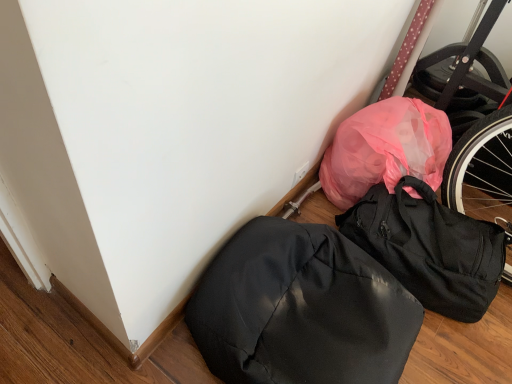
What do you see at coordinates (301, 309) in the screenshot?
I see `glossy black backpack at lower right, which is counted as the first backpack, starting from the left` at bounding box center [301, 309].

Where is `glossy black backpack at lower right, which is counted as the first backpack, starting from the left`? This screenshot has height=384, width=512. glossy black backpack at lower right, which is counted as the first backpack, starting from the left is located at coordinates (301, 309).

In order to click on matte black backpack at lower right, which is counted as the first backpack, starting from the right in this screenshot , I will do `click(430, 248)`.

What is the approximate width of matte black backpack at lower right, which is counted as the first backpack, starting from the right?

16.97 inches.

The width and height of the screenshot is (512, 384). Describe the element at coordinates (430, 248) in the screenshot. I see `matte black backpack at lower right, which is counted as the first backpack, starting from the right` at that location.

Where is `glossy black backpack at lower right, the 2th backpack viewed from the right`? glossy black backpack at lower right, the 2th backpack viewed from the right is located at coordinates (301, 309).

Would you say glossy black backpack at lower right, the 2th backpack viewed from the right, is to the left or to the right of matte black backpack at lower right, which is counted as the first backpack, starting from the right, in the picture?

From the image, it's evident that glossy black backpack at lower right, the 2th backpack viewed from the right, is to the left of matte black backpack at lower right, which is counted as the first backpack, starting from the right.

Which is behind, glossy black backpack at lower right, the 2th backpack viewed from the right, or matte black backpack at lower right, which is counted as the first backpack, starting from the right?

matte black backpack at lower right, which is counted as the first backpack, starting from the right, is behind.

Considering the positions of points (406, 344) and (452, 247), is point (406, 344) closer to camera compared to point (452, 247)?

Yes, point (406, 344) is closer to viewer.

From the image's perspective, which one is positioned lower, glossy black backpack at lower right, which is counted as the first backpack, starting from the left, or matte black backpack at lower right, the second backpack when ordered from left to right?

glossy black backpack at lower right, which is counted as the first backpack, starting from the left, from the image's perspective.

From a real-world perspective, which object stands above the other?

From a 3D spatial view, glossy black backpack at lower right, which is counted as the first backpack, starting from the left, is above.

Which object is thinner, glossy black backpack at lower right, which is counted as the first backpack, starting from the left, or matte black backpack at lower right, which is counted as the first backpack, starting from the right?

matte black backpack at lower right, which is counted as the first backpack, starting from the right.

In terms of height, does glossy black backpack at lower right, which is counted as the first backpack, starting from the left, look taller or shorter compared to matte black backpack at lower right, the second backpack when ordered from left to right?

Clearly, glossy black backpack at lower right, which is counted as the first backpack, starting from the left, is shorter compared to matte black backpack at lower right, the second backpack when ordered from left to right.

Between glossy black backpack at lower right, which is counted as the first backpack, starting from the left, and matte black backpack at lower right, which is counted as the first backpack, starting from the right, which one has smaller size?

With smaller size is matte black backpack at lower right, which is counted as the first backpack, starting from the right.

Would you say glossy black backpack at lower right, the 2th backpack viewed from the right, is outside matte black backpack at lower right, the second backpack when ordered from left to right?

Absolutely, glossy black backpack at lower right, the 2th backpack viewed from the right, is external to matte black backpack at lower right, the second backpack when ordered from left to right.

In the scene shown: Is glossy black backpack at lower right, the 2th backpack viewed from the right, directly adjacent to matte black backpack at lower right, which is counted as the first backpack, starting from the right?

No, glossy black backpack at lower right, the 2th backpack viewed from the right, is not beside matte black backpack at lower right, which is counted as the first backpack, starting from the right.

Is glossy black backpack at lower right, the 2th backpack viewed from the right, oriented away from matte black backpack at lower right, which is counted as the first backpack, starting from the right?

No, matte black backpack at lower right, which is counted as the first backpack, starting from the right, is not at the back of glossy black backpack at lower right, the 2th backpack viewed from the right.

How different are the orientations of glossy black backpack at lower right, the 2th backpack viewed from the right, and matte black backpack at lower right, the second backpack when ordered from left to right, in degrees?

1.92e-05 degrees separate the facing orientations of glossy black backpack at lower right, the 2th backpack viewed from the right, and matte black backpack at lower right, the second backpack when ordered from left to right.

Image resolution: width=512 pixels, height=384 pixels. I want to click on backpack on the left of the matte black backpack at lower right, which is counted as the first backpack, starting from the right, so click(x=301, y=309).

Considering the relative positions of matte black backpack at lower right, which is counted as the first backpack, starting from the right, and glossy black backpack at lower right, which is counted as the first backpack, starting from the left, in the image provided, is matte black backpack at lower right, which is counted as the first backpack, starting from the right, to the left of glossy black backpack at lower right, which is counted as the first backpack, starting from the left, from the viewer's perspective?

In fact, matte black backpack at lower right, which is counted as the first backpack, starting from the right, is to the right of glossy black backpack at lower right, which is counted as the first backpack, starting from the left.

Does matte black backpack at lower right, the second backpack when ordered from left to right, lie in front of glossy black backpack at lower right, which is counted as the first backpack, starting from the left?

No.

Considering the positions of points (369, 193) and (329, 249), is point (369, 193) closer to camera compared to point (329, 249)?

No, (369, 193) is further to viewer.

From the image's perspective, which is below, matte black backpack at lower right, the second backpack when ordered from left to right, or glossy black backpack at lower right, which is counted as the first backpack, starting from the left?

glossy black backpack at lower right, which is counted as the first backpack, starting from the left.

From a real-world perspective, is matte black backpack at lower right, the second backpack when ordered from left to right, beneath glossy black backpack at lower right, the 2th backpack viewed from the right?

Yes.

From the picture: Is matte black backpack at lower right, which is counted as the first backpack, starting from the right, wider than glossy black backpack at lower right, which is counted as the first backpack, starting from the left?

In fact, matte black backpack at lower right, which is counted as the first backpack, starting from the right, might be narrower than glossy black backpack at lower right, which is counted as the first backpack, starting from the left.

Is matte black backpack at lower right, the second backpack when ordered from left to right, taller or shorter than glossy black backpack at lower right, which is counted as the first backpack, starting from the left?

In the image, matte black backpack at lower right, the second backpack when ordered from left to right, appears to be taller than glossy black backpack at lower right, which is counted as the first backpack, starting from the left.

In terms of size, does matte black backpack at lower right, the second backpack when ordered from left to right, appear bigger or smaller than glossy black backpack at lower right, the 2th backpack viewed from the right?

Considering their sizes, matte black backpack at lower right, the second backpack when ordered from left to right, takes up less space than glossy black backpack at lower right, the 2th backpack viewed from the right.

Would you say matte black backpack at lower right, which is counted as the first backpack, starting from the right, is inside or outside glossy black backpack at lower right, the 2th backpack viewed from the right?

matte black backpack at lower right, which is counted as the first backpack, starting from the right, is not inside glossy black backpack at lower right, the 2th backpack viewed from the right, it's outside.

Is matte black backpack at lower right, the second backpack when ordered from left to right, far from glossy black backpack at lower right, the 2th backpack viewed from the right?

No, matte black backpack at lower right, the second backpack when ordered from left to right, is not far from glossy black backpack at lower right, the 2th backpack viewed from the right.

Is matte black backpack at lower right, which is counted as the first backpack, starting from the right, positioned with its back to glossy black backpack at lower right, which is counted as the first backpack, starting from the left?

No, matte black backpack at lower right, which is counted as the first backpack, starting from the right, is not facing the opposite direction of glossy black backpack at lower right, which is counted as the first backpack, starting from the left.

Measure the distance between matte black backpack at lower right, which is counted as the first backpack, starting from the right, and glossy black backpack at lower right, the 2th backpack viewed from the right.

matte black backpack at lower right, which is counted as the first backpack, starting from the right, and glossy black backpack at lower right, the 2th backpack viewed from the right, are 11.19 inches apart.

What are the coordinates of `backpack that is under the glossy black backpack at lower right, the 2th backpack viewed from the right (from a real-world perspective)` in the screenshot? It's located at (430, 248).

Find the location of a particular element. backpack below the matte black backpack at lower right, the second backpack when ordered from left to right (from the image's perspective) is located at coordinates (301, 309).

Locate an element on the screen. This screenshot has width=512, height=384. backpack above the matte black backpack at lower right, the second backpack when ordered from left to right (from a real-world perspective) is located at coordinates (301, 309).